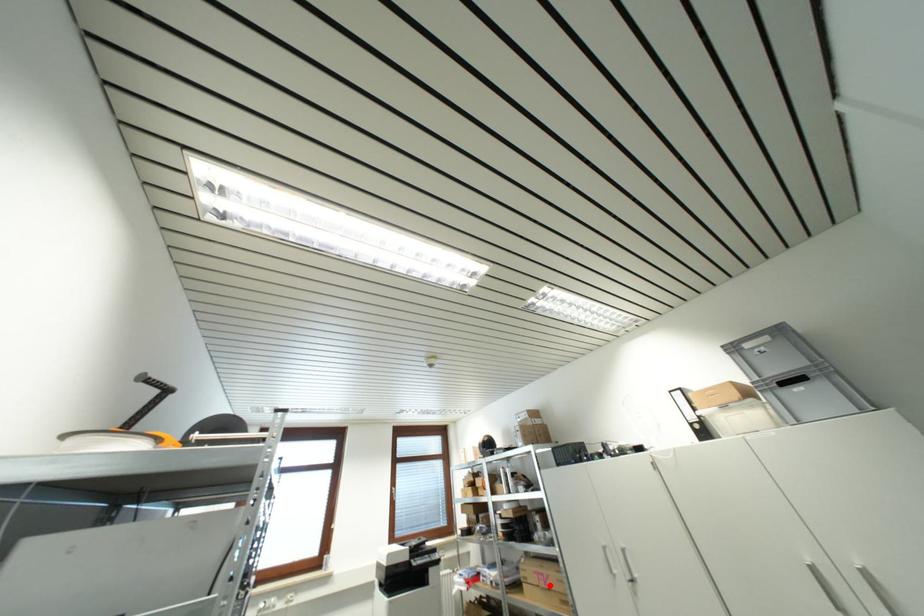
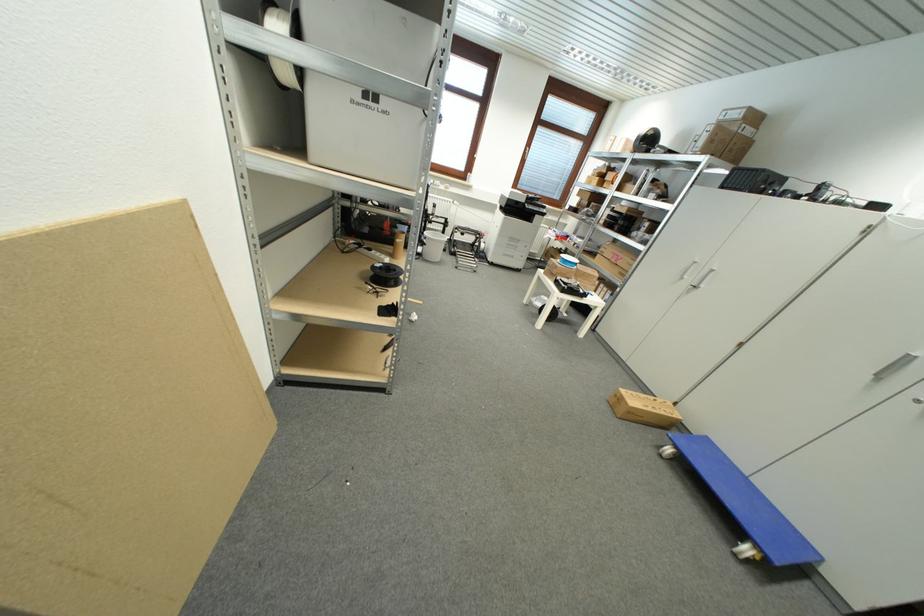
Locate, in the second image, the point that corresponds to the highlighted location in the first image.

(621, 262)